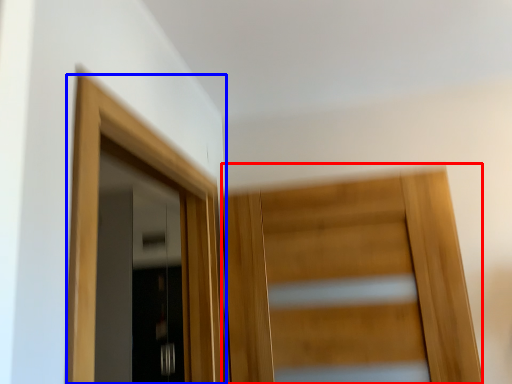
Question: Which of the following is the farthest to the observer, door (highlighted by a red box) or door (highlighted by a blue box)?

Choices:
 (A) door
 (B) door

Answer: (A)